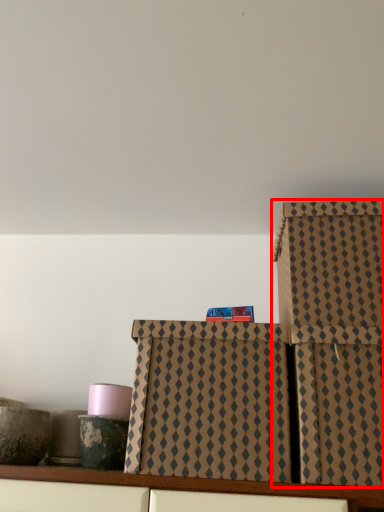
Question: Considering the relative positions of box (annotated by the red box) and box in the image provided, where is box (annotated by the red box) located with respect to the staircase?

Choices:
 (A) left
 (B) right

Answer: (B)